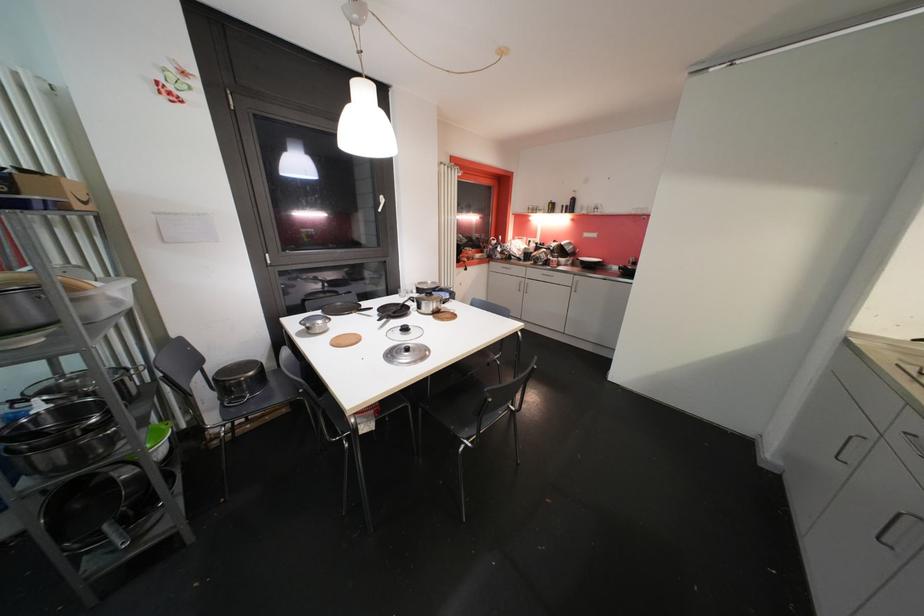
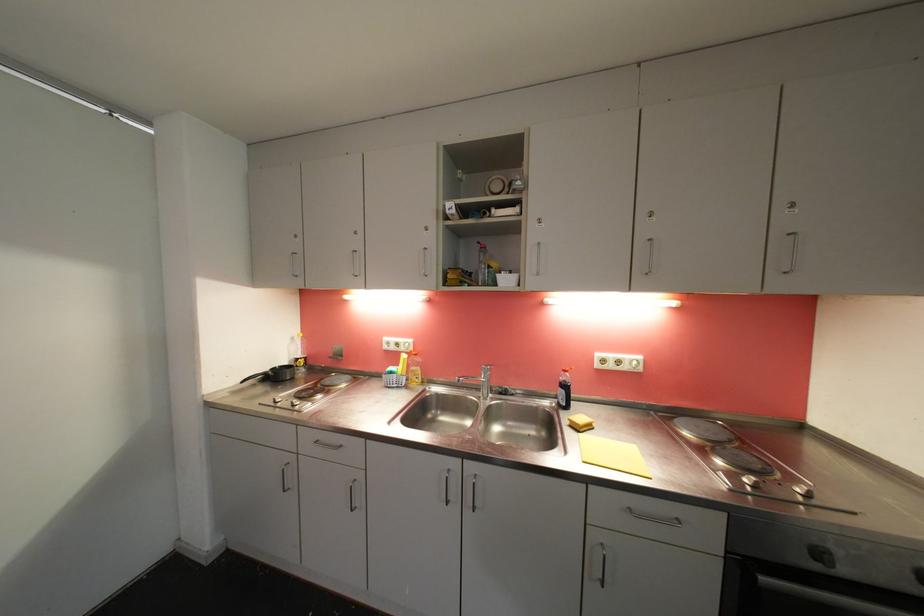
Question: The camera is either moving clockwise (left) or counter-clockwise (right) around the object. The first image is from the beginning of the video and the second image is from the end. Is the camera moving left or right when shooting the video?

Choices:
 (A) Left
 (B) Right

Answer: (A)